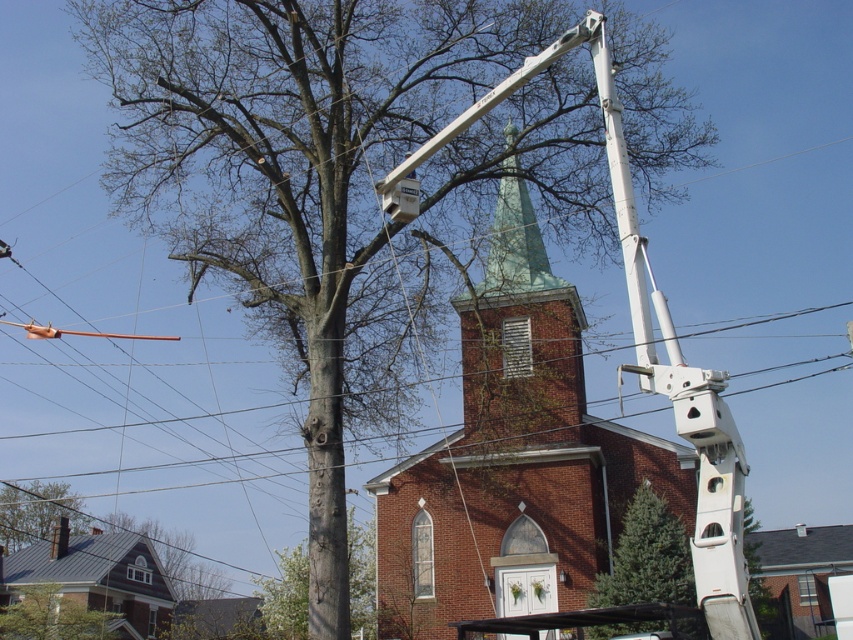
Question: Among these points, which one is nearest to the camera?

Choices:
 (A) click(637, 557)
 (B) click(35, 552)
 (C) click(462, 577)
 (D) click(42, 538)

Answer: (A)

Question: From the image, what is the correct spatial relationship of smooth gray bark at center in relation to smooth gray tree trunk at lower left?

Choices:
 (A) left
 (B) right

Answer: (B)

Question: Is smooth gray bark at center thinner than smooth gray tree trunk at lower left?

Choices:
 (A) yes
 (B) no

Answer: (B)

Question: Among these points, which one is nearest to the camera?

Choices:
 (A) (643, 568)
 (B) (401, 525)
 (C) (47, 547)

Answer: (A)

Question: Which point is closer to the camera taking this photo?

Choices:
 (A) (21, 538)
 (B) (680, 524)
 (C) (419, 493)

Answer: (B)

Question: Is brick church at center in front of green textured evergreen tree at lower right?

Choices:
 (A) yes
 (B) no

Answer: (A)